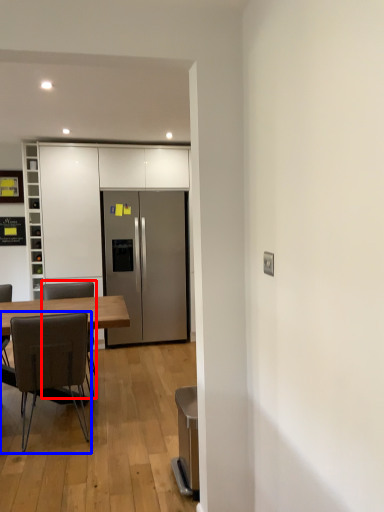
Question: Which object is closer to the camera taking this photo, chair (highlighted by a red box) or chair (highlighted by a blue box)?

Choices:
 (A) chair
 (B) chair

Answer: (B)